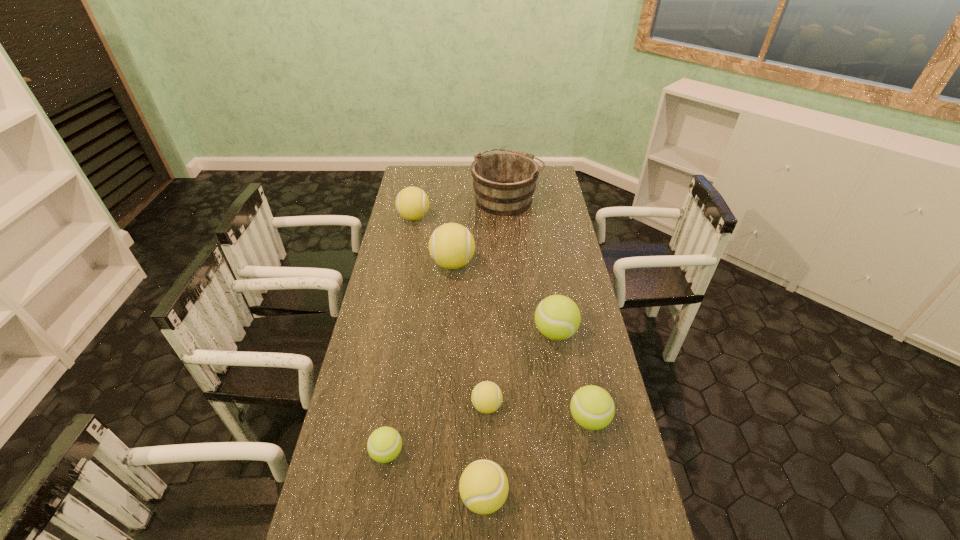
Locate an element on the screen. This screenshot has width=960, height=540. blank region between the second smallest green tennis ball and the nearest tennis ball is located at coordinates (537, 458).

Where is `free space between the smallest green tennis ball and the fifth nearest object`? The image size is (960, 540). free space between the smallest green tennis ball and the fifth nearest object is located at coordinates (471, 393).

You are a GUI agent. You are given a task and a screenshot of the screen. Output one action in this format:
    pyautogui.click(x=<x>, y=<y>)
    Task: Click on the free area in between the nearest yellow tennis ball and the third nearest yellow tennis ball
    This screenshot has width=960, height=540.
    Given the screenshot: What is the action you would take?
    pyautogui.click(x=468, y=380)

Where is `vacant point located between the tallest tennis ball and the smallest yellow tennis ball`? The width and height of the screenshot is (960, 540). vacant point located between the tallest tennis ball and the smallest yellow tennis ball is located at coordinates (469, 335).

The image size is (960, 540). Identify the location of the seventh closest object to the third farthest tennis ball. (412, 203).

The width and height of the screenshot is (960, 540). In order to click on object that stands as the closest to the farthest tennis ball in this screenshot , I will do `click(451, 245)`.

The height and width of the screenshot is (540, 960). I want to click on the closest tennis ball to the smallest green tennis ball, so click(483, 486).

Identify which tennis ball is located as the fourth nearest to the wine bucket. Please provide its 2D coordinates. Your answer should be formatted as a tuple, i.e. [(x, y)], where the tuple contains the x and y coordinates of a point satisfying the conditions above.

[(486, 397)]

I want to click on the closest yellow tennis ball to the wine bucket, so click(412, 203).

You are a GUI agent. You are given a task and a screenshot of the screen. Output one action in this format:
    pyautogui.click(x=<x>, y=<y>)
    Task: Click on the third closest yellow tennis ball to the leftmost yellow tennis ball
    The width and height of the screenshot is (960, 540).
    Given the screenshot: What is the action you would take?
    pyautogui.click(x=483, y=486)